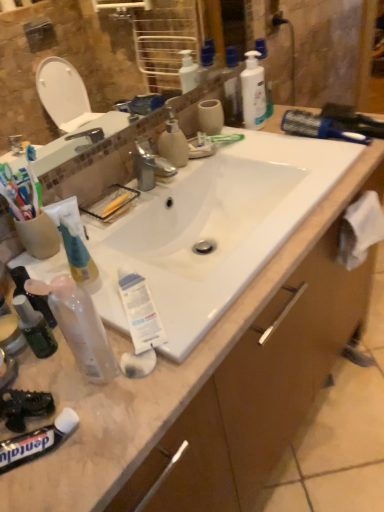
The height and width of the screenshot is (512, 384). Describe the element at coordinates (232, 87) in the screenshot. I see `translucent plastic bottles at upper center, the 2th toiletry positioned from the left` at that location.

I want to click on white matte tube at left, the 3th toothpaste viewed from the front, so click(73, 240).

What do you see at coordinates (73, 240) in the screenshot? This screenshot has height=512, width=384. I see `white matte tube at left, the 3th toothpaste viewed from the front` at bounding box center [73, 240].

This screenshot has height=512, width=384. What do you see at coordinates (253, 92) in the screenshot? I see `white glossy bottle at upper right, the first cleaning product in the top-to-bottom sequence` at bounding box center [253, 92].

At what (x,y) coordinates should I click in order to perform the action: click on white matte tube at center, the 2th toothpaste in the top-to-bottom sequence. Please return your answer as a coordinate pair (x, y). The height and width of the screenshot is (512, 384). Looking at the image, I should click on (141, 313).

You are a GUI agent. You are given a task and a screenshot of the screen. Output one action in this format:
    pyautogui.click(x=<x>, y=<y>)
    Task: Click on the transparent plastic spray bottle at lower left, positioned as the 1th toiletry in bottom-to-top order
    
    Given the screenshot: What is the action you would take?
    pyautogui.click(x=79, y=326)

Where is `translucent plastic bottles at upper center, the 2th toiletry positioned from the left`? translucent plastic bottles at upper center, the 2th toiletry positioned from the left is located at coordinates (232, 87).

From the image's perspective, is black matte toothpaste at lower left, the first toothpaste positioned from the bottom, above or below transparent plastic spray bottle at lower left, positioned as the 1th toiletry in bottom-to-top order?

black matte toothpaste at lower left, the first toothpaste positioned from the bottom, is below transparent plastic spray bottle at lower left, positioned as the 1th toiletry in bottom-to-top order.

Considering the relative sizes of black matte toothpaste at lower left, arranged as the 1th toothpaste when viewed from the front, and transparent plastic spray bottle at lower left, the 1th toiletry from the front, in the image provided, is black matte toothpaste at lower left, arranged as the 1th toothpaste when viewed from the front, wider than transparent plastic spray bottle at lower left, the 1th toiletry from the front,?

No, black matte toothpaste at lower left, arranged as the 1th toothpaste when viewed from the front, is not wider than transparent plastic spray bottle at lower left, the 1th toiletry from the front.

Is black matte toothpaste at lower left, the 3th toothpaste when ordered from top to bottom, located outside transparent plastic spray bottle at lower left, the 1th toiletry from the front?

Indeed, black matte toothpaste at lower left, the 3th toothpaste when ordered from top to bottom, is completely outside transparent plastic spray bottle at lower left, the 1th toiletry from the front.

From the picture: Is black matte toothpaste at lower left, the 3th toothpaste when ordered from top to bottom, facing towards transparent plastic spray bottle at lower left, the 1th toiletry from the front?

No, black matte toothpaste at lower left, the 3th toothpaste when ordered from top to bottom, does not turn towards transparent plastic spray bottle at lower left, the 1th toiletry from the front.

Considering the positions of objects black matte toothpaste at lower left, the first toothpaste positioned from the bottom, and white matte tube at left, the first toothpaste when ordered from back to front, in the image provided, who is more to the right, black matte toothpaste at lower left, the first toothpaste positioned from the bottom, or white matte tube at left, the first toothpaste when ordered from back to front,?

From the viewer's perspective, white matte tube at left, the first toothpaste when ordered from back to front, appears more on the right side.

Does black matte toothpaste at lower left, the first toothpaste positioned from the bottom, have a lesser height compared to white matte tube at left, the first toothpaste when ordered from back to front?

Yes.

From the image's perspective, which is above, black matte toothpaste at lower left, acting as the third toothpaste starting from the back, or white matte tube at left, the 3th toothpaste viewed from the front?

white matte tube at left, the 3th toothpaste viewed from the front.

Considering the sizes of black matte toothpaste at lower left, the 3th toothpaste when ordered from top to bottom, and white matte tube at left, the 3th toothpaste viewed from the front, in the image, is black matte toothpaste at lower left, the 3th toothpaste when ordered from top to bottom, bigger or smaller than white matte tube at left, the 3th toothpaste viewed from the front,?

Considering their sizes, black matte toothpaste at lower left, the 3th toothpaste when ordered from top to bottom, takes up more space than white matte tube at left, the 3th toothpaste viewed from the front.

Does matte plastic soap dispenser at center, marked as the second cleaning product in a top-to-bottom arrangement, lie behind white glossy bottle at upper right, positioned as the 2th cleaning product in bottom-to-top order?

No, it is not.

Where is `cleaning product behind the matte plastic soap dispenser at center, the first cleaning product in the bottom-to-top sequence`? cleaning product behind the matte plastic soap dispenser at center, the first cleaning product in the bottom-to-top sequence is located at coordinates (253, 92).

Can you confirm if matte plastic soap dispenser at center, which is the first cleaning product in left-to-right order, is smaller than white glossy bottle at upper right, positioned as the first cleaning product in back-to-front order?

Indeed, matte plastic soap dispenser at center, which is the first cleaning product in left-to-right order, has a smaller size compared to white glossy bottle at upper right, positioned as the first cleaning product in back-to-front order.

How different are the orientations of matte plastic soap dispenser at center, the 2th cleaning product when ordered from right to left, and white glossy bottle at upper right, acting as the 2th cleaning product starting from the front, in degrees?

3.55 degrees.

Locate an element on the screen. Image resolution: width=384 pixels, height=512 pixels. mouthwash that appears on the left of translucent plastic bottles at upper center, acting as the 2th toiletry starting from the front is located at coordinates (34, 328).

From the image's perspective, which one is positioned higher, translucent plastic mouthwash at lower left or translucent plastic bottles at upper center, the first toiletry from the right?

translucent plastic bottles at upper center, the first toiletry from the right, is shown above in the image.

Is translucent plastic mouthwash at lower left oriented away from translucent plastic bottles at upper center, the first toiletry from the right?

That's not correct — translucent plastic mouthwash at lower left is not looking away from translucent plastic bottles at upper center, the first toiletry from the right.

From a real-world perspective, between translucent plastic mouthwash at lower left and translucent plastic bottles at upper center, which is the 1th toiletry from back to front, who is vertically higher?

In real-world perspective, translucent plastic bottles at upper center, which is the 1th toiletry from back to front, is above.

Is there a large distance between translucent plastic bottles at upper center, the first toiletry from the right, and white fabric at right?

That's right, there is a large distance between translucent plastic bottles at upper center, the first toiletry from the right, and white fabric at right.

Is point (239, 113) closer or farther from the camera than point (360, 259)?

Point (239, 113).

The width and height of the screenshot is (384, 512). Identify the location of toiletry lying behind the white fabric at right. (232, 87).

Considering the sizes of objects translucent plastic bottles at upper center, marked as the first toiletry in a top-to-bottom arrangement, and white fabric at right in the image provided, who is bigger, translucent plastic bottles at upper center, marked as the first toiletry in a top-to-bottom arrangement, or white fabric at right?

Bigger between the two is white fabric at right.

Is transparent plastic spray bottle at lower left, which is the first toiletry in left-to-right order, located outside blue plastic brush at upper right?

transparent plastic spray bottle at lower left, which is the first toiletry in left-to-right order, lies outside blue plastic brush at upper right's area.

Between transparent plastic spray bottle at lower left, the 2th toiletry when ordered from right to left, and blue plastic brush at upper right, which one is positioned in front?

transparent plastic spray bottle at lower left, the 2th toiletry when ordered from right to left, is closer to the camera.

Which object is thinner, transparent plastic spray bottle at lower left, which is the first toiletry in left-to-right order, or blue plastic brush at upper right?

With smaller width is transparent plastic spray bottle at lower left, which is the first toiletry in left-to-right order.

From a real-world perspective, is transparent plastic spray bottle at lower left, positioned as the 1th toiletry in bottom-to-top order, physically below blue plastic brush at upper right?

Incorrect, from a real-world perspective, transparent plastic spray bottle at lower left, positioned as the 1th toiletry in bottom-to-top order, is higher than blue plastic brush at upper right.

From the picture: Is translucent plastic bottles at upper center, the first toiletry from the right, positioned behind blue plastic brush at upper right?

Yes, it is behind blue plastic brush at upper right.

Consider the image. Is translucent plastic bottles at upper center, the 2th toiletry positioned from the left, far away from blue plastic brush at upper right?

Yes.

Does translucent plastic bottles at upper center, the 2th toiletry positioned from the left, turn towards blue plastic brush at upper right?

Yes, translucent plastic bottles at upper center, the 2th toiletry positioned from the left, is oriented towards blue plastic brush at upper right.

Is blue plastic brush at upper right a part of translucent plastic bottles at upper center, which is the 1th toiletry from back to front?

Actually, blue plastic brush at upper right is outside translucent plastic bottles at upper center, which is the 1th toiletry from back to front.

Locate an element on the screen. toiletry that is the 1st one when counting rightward from the black matte toothpaste at lower left, arranged as the 1th toothpaste when viewed from the front is located at coordinates (79, 326).

The image size is (384, 512). What are the coordinates of `toothpaste that is the 2nd one below the white matte tube at left, which is the third toothpaste in bottom-to-top order (from a real-world perspective)` in the screenshot? It's located at (36, 441).

Considering their positions, is transparent plastic spray bottle at lower left, the 1th toiletry from the front, positioned closer to white matte tube at left, the 3th toothpaste viewed from the front, than brown wood drawer at lower right?

transparent plastic spray bottle at lower left, the 1th toiletry from the front.

Based on the photo, considering their positions, is translucent plastic bottles at upper center, acting as the 2th toiletry starting from the front, positioned further to matte plastic soap dispenser at center, which is the 2th cleaning product in back-to-front order, than brown wood drawer at lower right?

translucent plastic bottles at upper center, acting as the 2th toiletry starting from the front.

When comparing their distances from blue plastic brush at upper right, does brown wood drawer at lower right or translucent plastic bottles at upper center, the 2th toiletry positioned from the left, seem closer?

The object closer to blue plastic brush at upper right is brown wood drawer at lower right.

From the image, which object appears to be nearer to matte plastic soap dispenser at center, the first cleaning product in the bottom-to-top sequence, translucent plastic bottles at upper center, acting as the 2th toiletry starting from the front, or white matte tube at left, which appears as the first toothpaste when viewed from the top?

The object closer to matte plastic soap dispenser at center, the first cleaning product in the bottom-to-top sequence, is white matte tube at left, which appears as the first toothpaste when viewed from the top.

Based on their spatial positions, is translucent plastic bottles at upper center, the second toiletry from the bottom, or white fabric at right further from white matte tube at center, the 2th toothpaste in the top-to-bottom sequence?

Based on the image, translucent plastic bottles at upper center, the second toiletry from the bottom, appears to be further to white matte tube at center, the 2th toothpaste in the top-to-bottom sequence.

When comparing their distances from white glossy bottle at upper right, positioned as the 2th cleaning product in bottom-to-top order, does transparent plastic spray bottle at lower left, the 2th toiletry when ordered from right to left, or blue plastic brush at upper right seem closer?

blue plastic brush at upper right.

When comparing their distances from black matte toothpaste at lower left, the 3th toothpaste when ordered from top to bottom, does translucent plastic bottles at upper center, which is the 1th toiletry from back to front, or white fabric at right seem closer?

white fabric at right is closer to black matte toothpaste at lower left, the 3th toothpaste when ordered from top to bottom.

From the image, which object appears to be nearer to translucent plastic mouthwash at lower left, translucent plastic bottles at upper center, the second toiletry from the bottom, or white glossy bottle at upper right, positioned as the 2th cleaning product in bottom-to-top order?

Based on the image, white glossy bottle at upper right, positioned as the 2th cleaning product in bottom-to-top order, appears to be nearer to translucent plastic mouthwash at lower left.

The height and width of the screenshot is (512, 384). I want to click on brush situated between white matte tube at left, the first toothpaste when ordered from back to front, and brown wood drawer at lower right from left to right, so click(x=318, y=127).

Image resolution: width=384 pixels, height=512 pixels. Find the location of `cleaning product positioned between transparent plastic spray bottle at lower left, which is the first toiletry in left-to-right order, and blue plastic brush at upper right from near to far`. cleaning product positioned between transparent plastic spray bottle at lower left, which is the first toiletry in left-to-right order, and blue plastic brush at upper right from near to far is located at coordinates (173, 142).

Where is `toilet paper between white glossy bottle at upper right, the 1th cleaning product viewed from the right, and black matte toothpaste at lower left, acting as the third toothpaste starting from the back, from top to bottom`? Image resolution: width=384 pixels, height=512 pixels. toilet paper between white glossy bottle at upper right, the 1th cleaning product viewed from the right, and black matte toothpaste at lower left, acting as the third toothpaste starting from the back, from top to bottom is located at coordinates (360, 230).

The image size is (384, 512). Identify the location of cleaning product between matte plastic soap dispenser at center, the first cleaning product in the bottom-to-top sequence, and blue plastic brush at upper right. (253, 92).